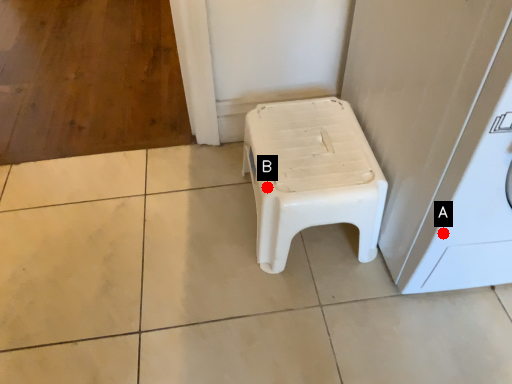
Question: Two points are circled on the image, labeled by A and B beside each circle. Which point is farther from the camera taking this photo?

Choices:
 (A) A is further
 (B) B is further

Answer: (B)